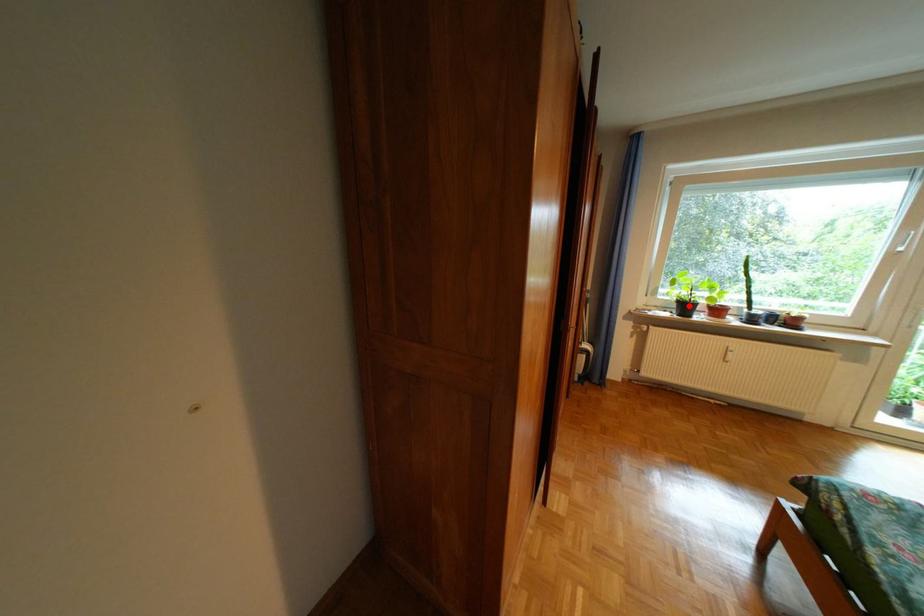
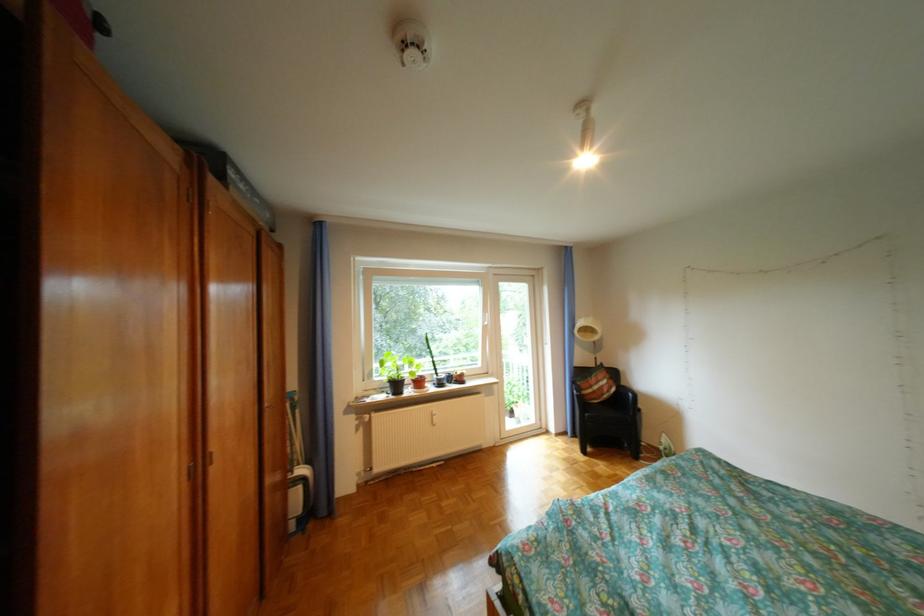
Locate, in the second image, the point that corresponds to the highlighted location in the first image.

(403, 386)